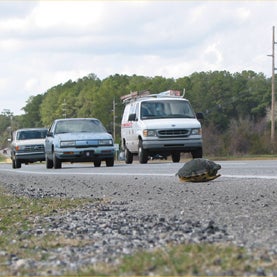
In order to click on paint in this screenshot , I will do `click(106, 173)`.